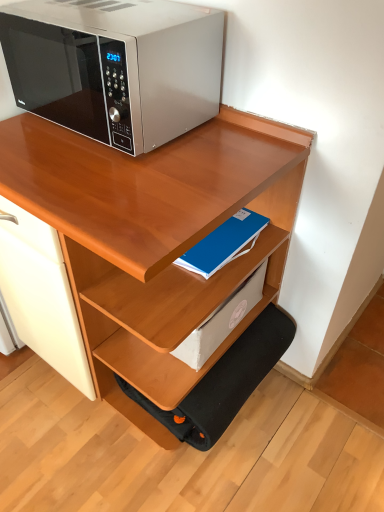
Locate an element on the screen. Image resolution: width=384 pixels, height=512 pixels. vacant space in front of satin silver microwave at upper left is located at coordinates (118, 175).